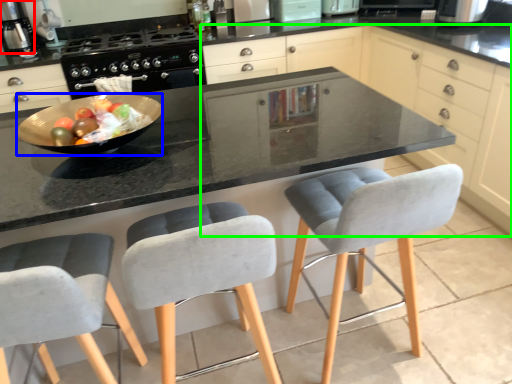
Question: Which is nearer to the kitchen appliance (highlighted by a red box)? bowl (highlighted by a blue box) or cabinetry (highlighted by a green box).

Choices:
 (A) bowl
 (B) cabinetry

Answer: (A)